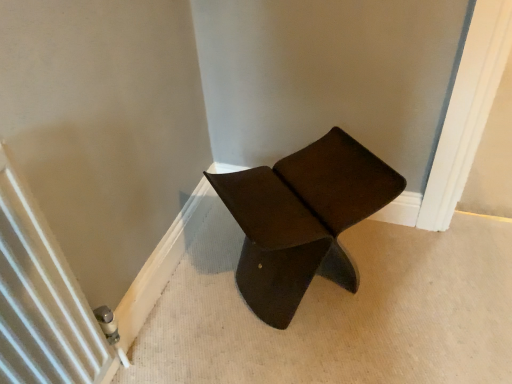
Identify the location of vacant space in front of brown leather stool at center. (322, 350).